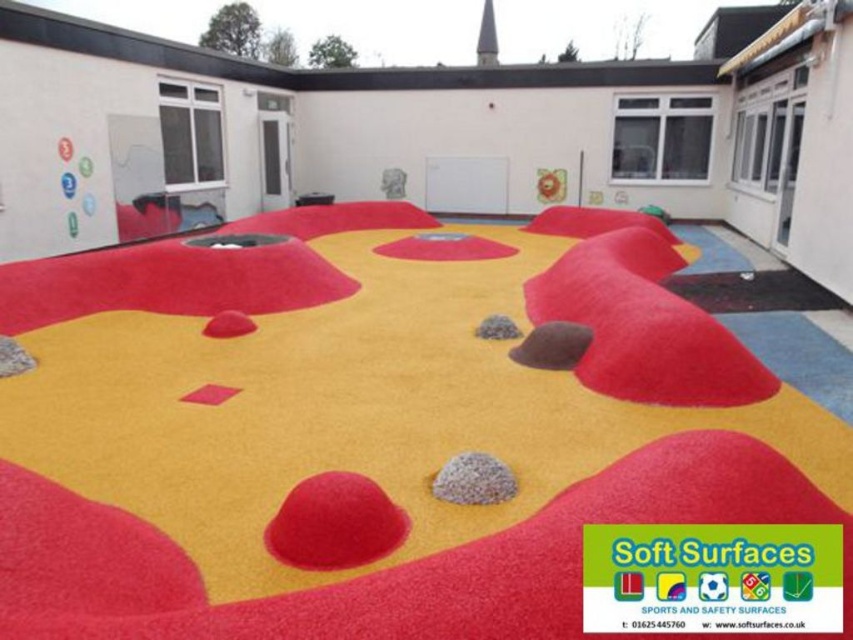
You are a child playing in the playground and you see the gray gravel stone at center and the gray gravel at center. Which one is closer to you?

The gray gravel stone at center is closer to you because it is in front of the gray gravel at center.

You are standing at point A and want to walk to point B. The playground has two points marked as point A at coordinates point A is point (x=589, y=364) and point B is at point (x=486, y=500). According to the image, which point is closer to you when you are at point A?

Point B at (x=486, y=500) is closer to you because point A at (x=589, y=364) is behind it.

You are standing at the playground and see the gray gravel stone at center located at point (473, 480). If you move 0.1 units to the north, will you be closer to the white building in the background?

Moving 0.1 units north from point (473, 480) would place you at 0.750, 0.656. Since the white building is in the background, it is further away from the playground area. Therefore, moving north would not bring you closer to the building. You would remain at the same distance relative to the building.